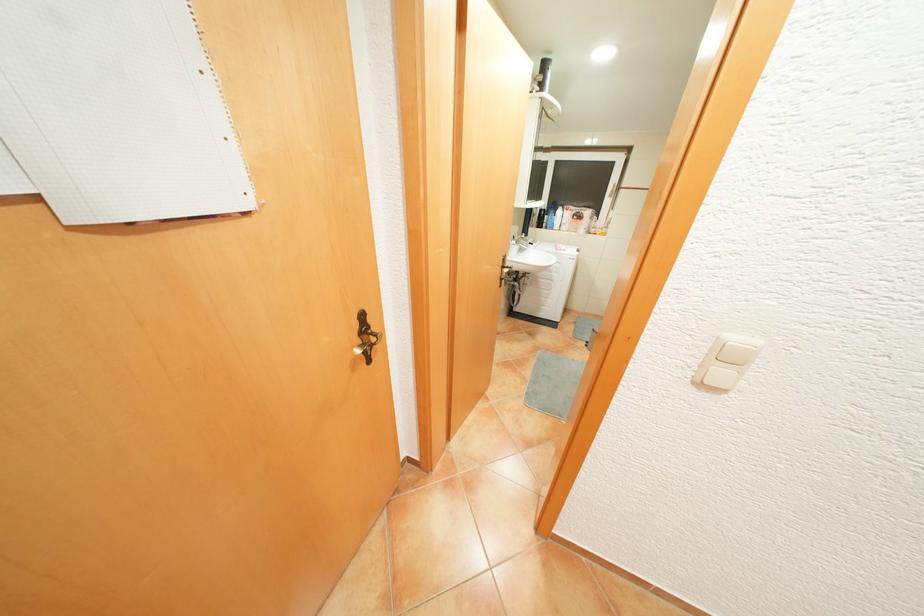
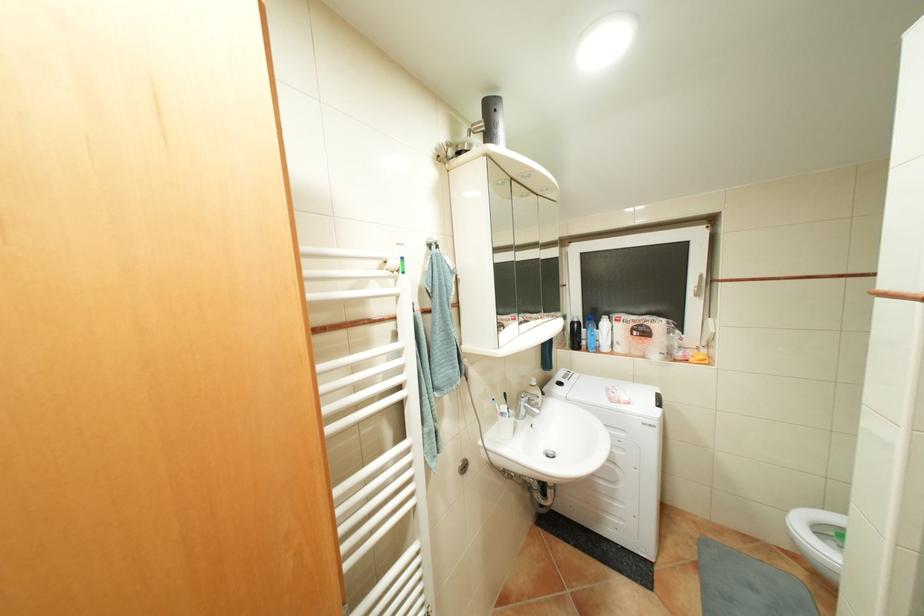
Which direction would the cameraman need to move to produce the second image?

The cameraman walked toward right, forward.